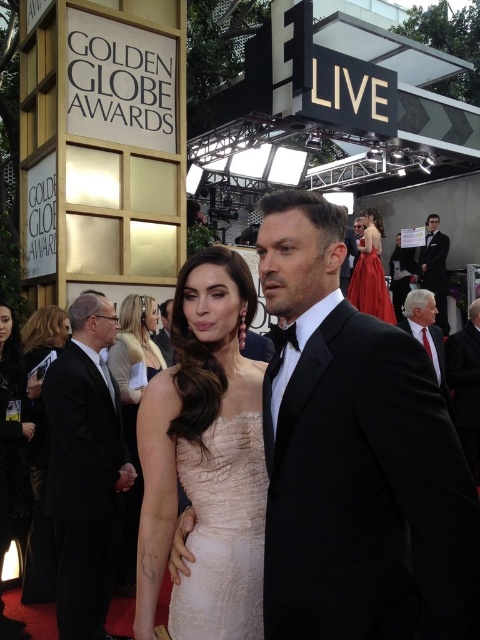
Question: Does light beige lace dress at center appear on the right side of black leather dress at lower left?

Choices:
 (A) no
 (B) yes

Answer: (B)

Question: Which object appears farthest from the camera in this image?

Choices:
 (A) black suit at left
 (B) black satin suit at right
 (C) white textured suit at right
 (D) black leather dress at lower left

Answer: (B)

Question: Does shiny red dress at upper right lie behind white textured suit at right?

Choices:
 (A) yes
 (B) no

Answer: (A)

Question: Among these objects, which one is farthest from the camera?

Choices:
 (A) shiny red dress at upper right
 (B) black leather dress at lower left
 (C) ivory lace dress at center
 (D) lace dress at center

Answer: (A)

Question: Does light beige lace dress at center come behind black tuxedo at right?

Choices:
 (A) no
 (B) yes

Answer: (A)

Question: Which point appears farthest from the camera in this image?

Choices:
 (A) (396, 253)
 (B) (128, 566)
 (C) (468, 428)
 (D) (433, 268)

Answer: (A)